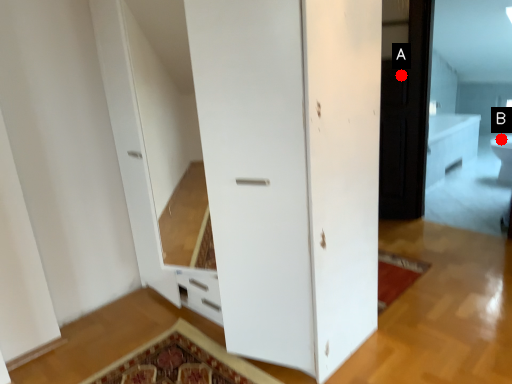
Question: Two points are circled on the image, labeled by A and B beside each circle. Which of the following is the farthest from the observer?

Choices:
 (A) A is further
 (B) B is further

Answer: (B)